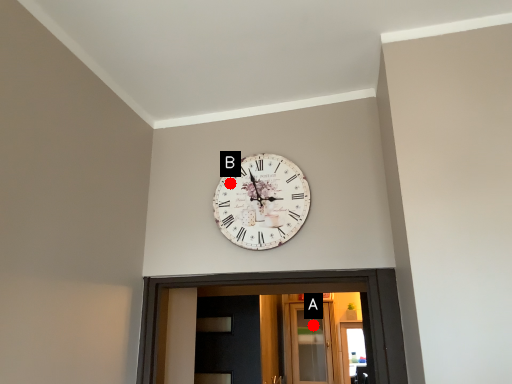
Question: Two points are circled on the image, labeled by A and B beside each circle. Which of the following is the farthest from the observer?

Choices:
 (A) A is further
 (B) B is further

Answer: (A)